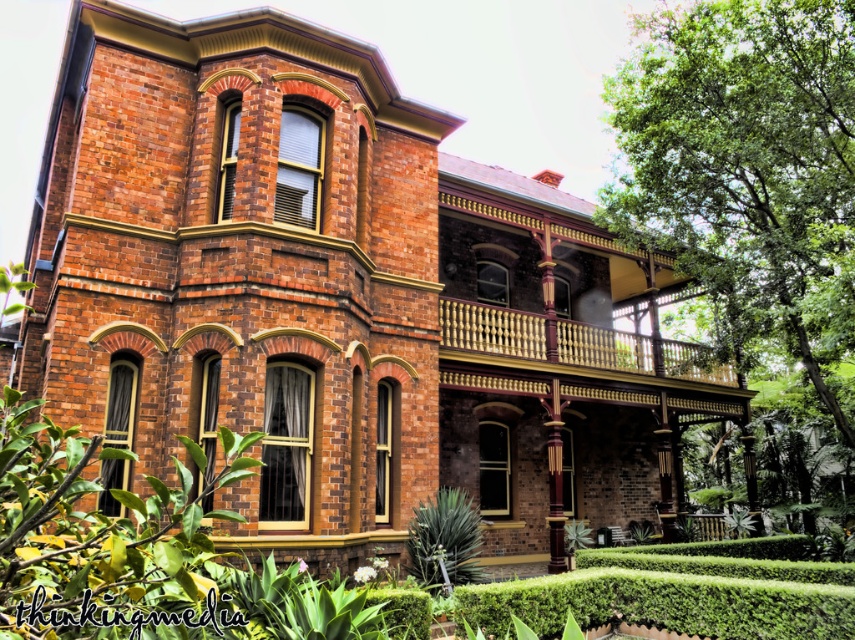
Is point (746, 195) positioned behind point (464, 561)?

Yes.

Does green leafy tree at right have a greater width compared to green leafy hedge at lower center?

No.

Is point (823, 246) farther from viewer compared to point (463, 547)?

Yes, point (823, 246) is farther from viewer.

At what (x,y) coordinates should I click in order to perform the action: click on green leafy tree at right. Please return your answer as a coordinate pair (x, y). Image resolution: width=855 pixels, height=640 pixels. Looking at the image, I should click on (747, 170).